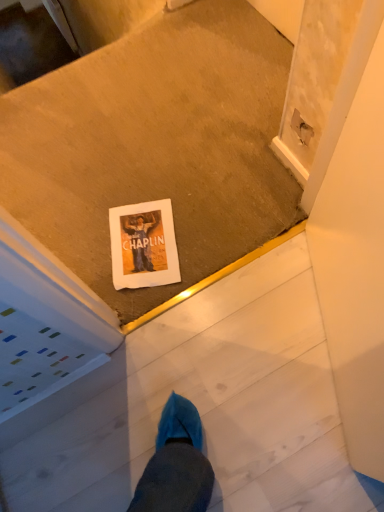
Find the location of a particular element. blank space above white paper at center (from a real-world perspective) is located at coordinates (141, 240).